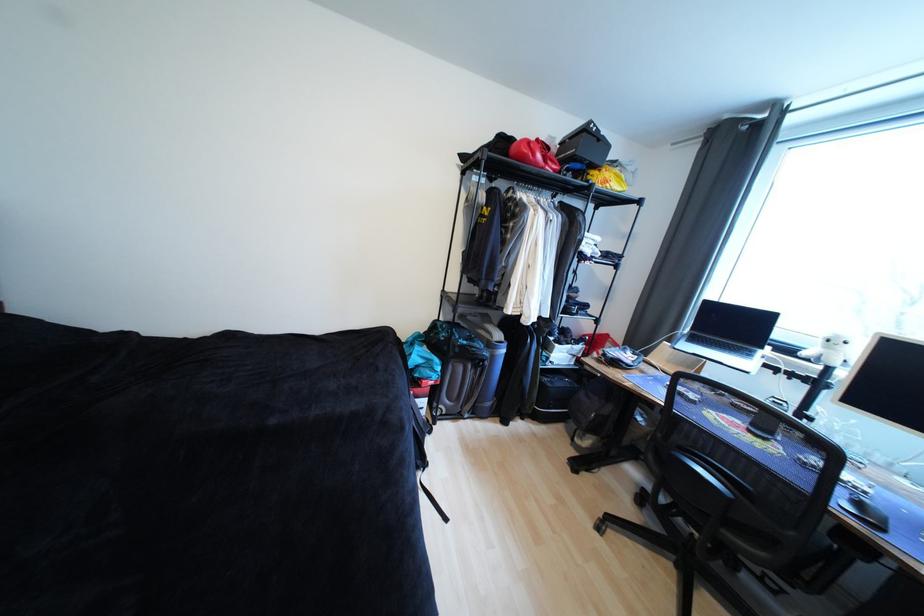
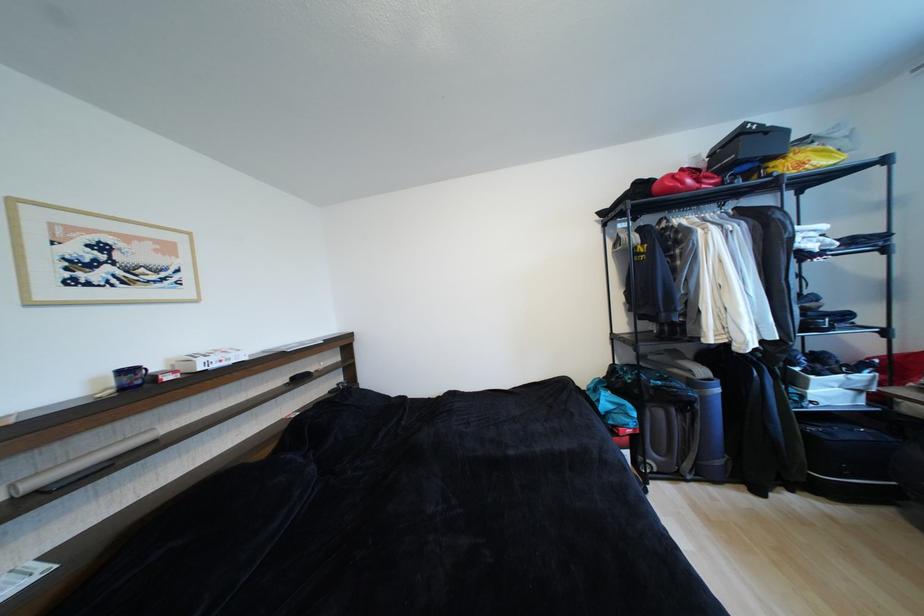
The point at (x=529, y=159) is marked in the first image. Where is the corresponding point in the second image?

(676, 192)